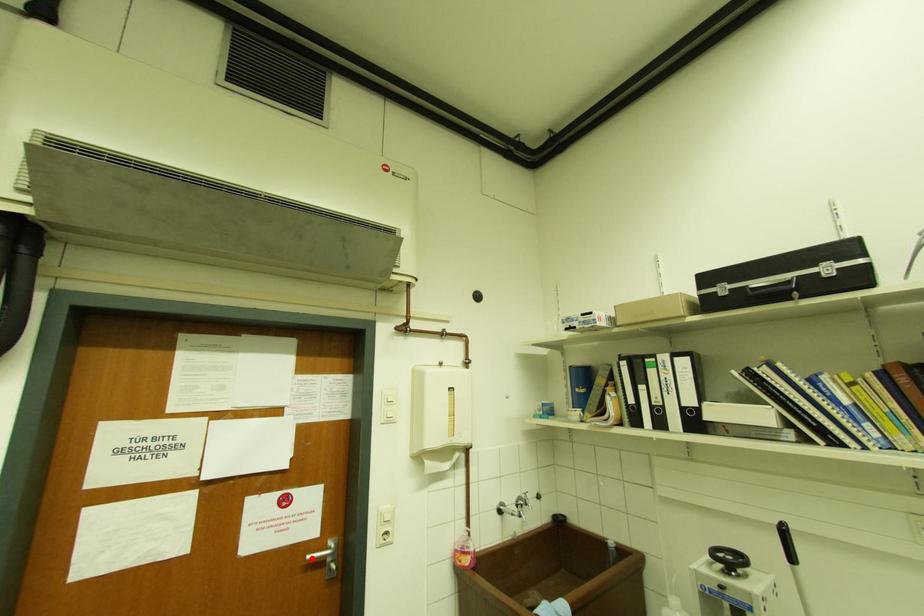
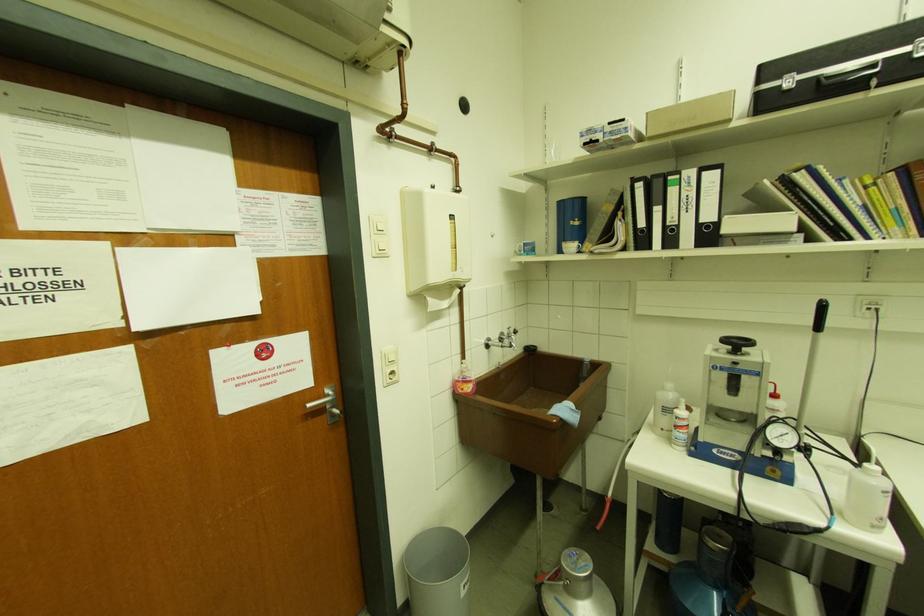
Where in the second image is the point corresponding to the highlighted location from the first image?

(312, 407)